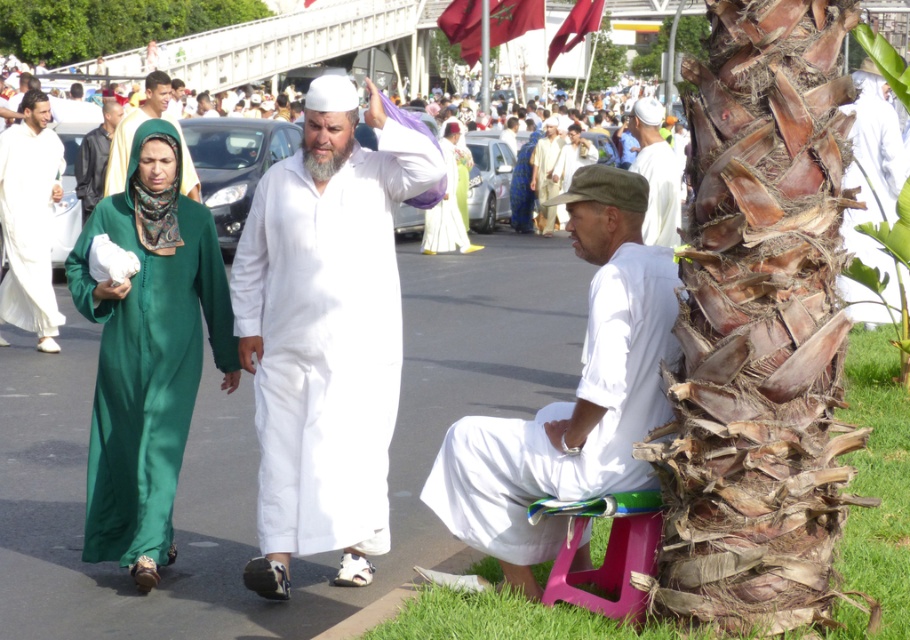
You are standing at the point marked as point (764, 28). You want to walk to the palm tree trunk on the right. Is there enough space between the two people walking to your left and the palm tree trunk to pass through safely?

The two people are 4.46 meters apart from each other. Since the palm tree trunk is on the right side and the people are to your left, there is sufficient space between them and the tree to pass through safely.

You are standing in the street scene and want to take a photo of the white cotton shirt at lower right without the brown rough bark at right blocking it. How should you adjust your position?

Move to the left side of the scene so that the white cotton shirt at lower right is no longer obscured by the brown rough bark at right, which is closer to you.